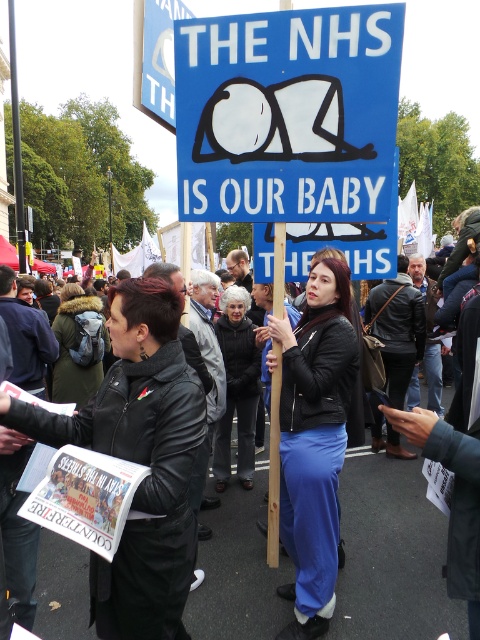
Does blue paper sign at center have a larger size compared to matte black jacket at center?

Yes, blue paper sign at center is bigger than matte black jacket at center.

This screenshot has width=480, height=640. What are the coordinates of `blue paper sign at center` in the screenshot? It's located at (288, 113).

Find the location of a particular element. blue paper sign at center is located at coordinates (288, 113).

Is blue paper sign at center shorter than black leather jacket at center?

In fact, blue paper sign at center may be taller than black leather jacket at center.

The width and height of the screenshot is (480, 640). Identify the location of blue paper sign at center. (288, 113).

In order to click on blue paper sign at center in this screenshot , I will do click(x=288, y=113).

Consider the image. Is black leather jacket at center further to camera compared to matte black jacket at center?

Yes.

Does point (336, 609) come farther from viewer compared to point (288, 499)?

That is False.

Where is `black leather jacket at center`? black leather jacket at center is located at coordinates (391, 554).